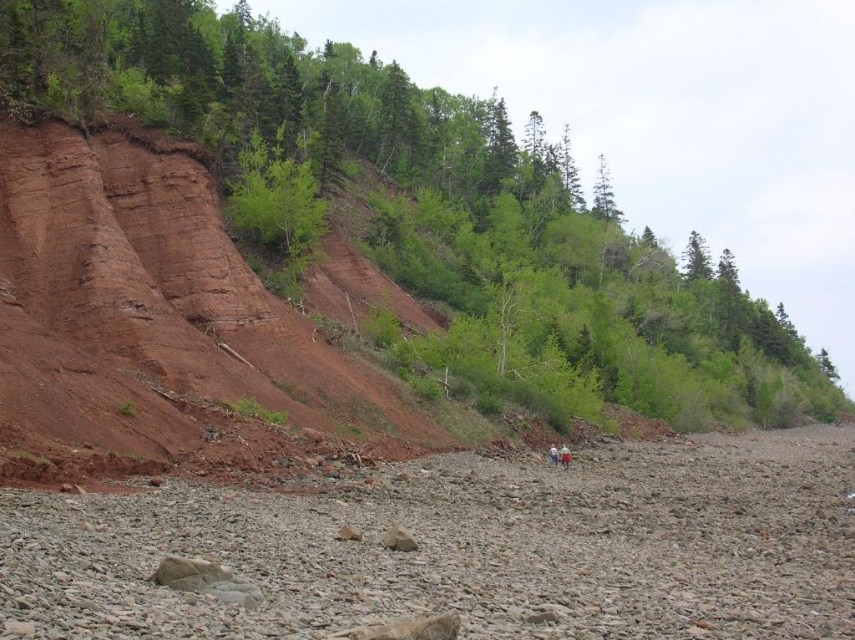
You are a hiker who wants to take a photo of the green leafy tree at upper center and the light blue denim jeans at center. Which object should you focus on first if you want to capture both in a single frame without moving the camera?

The green leafy tree at upper center has a greater height compared to the light blue denim jeans at center, so you should focus on the green leafy tree at upper center first to ensure it fits within the frame.

You are standing at the base of the cliff in the rugged landscape and want to reach a specific location. You see two points marked in the image. Which point, point [310,321] or point [564,460], is closer to your current position?

Point [310,321] is closer to your current position because it is further to the camera than point [564,460], meaning it is nearer to the observer standing at the base of the cliff.